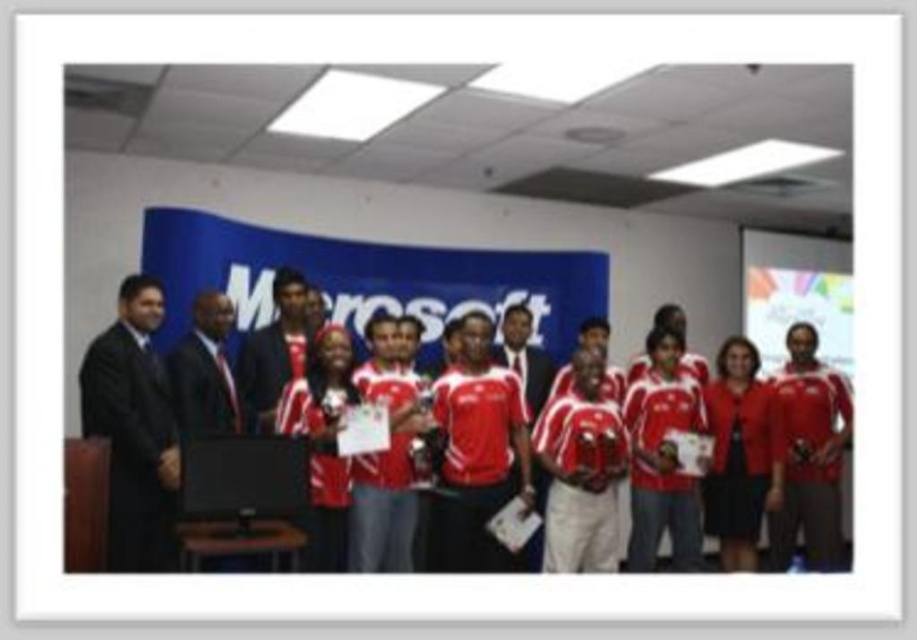
You are standing in the conference room and see the point marked at coordinate (190, 365). What object is located at that point?

The point at coordinate (190, 365) corresponds to the matte red jersey at center.

Based on the photo, you are standing in the middle of the room and see the point at coordinates (190, 365). What object is located at that point?

The point at coordinates (190, 365) corresponds to the matte red jersey at center.

You are standing at the entrance of the room and want to locate the matte red jersey at center. According to the coordinates provided, where should you look relative to the entrance?

The matte red jersey at center is located at coordinates point (190, 365), which means it is positioned approximately 57.3 percent from the left edge and 20.8 percent from the bottom edge of the room. To locate it from the entrance, you should look towards the central area slightly to the right and lower portion of the room.